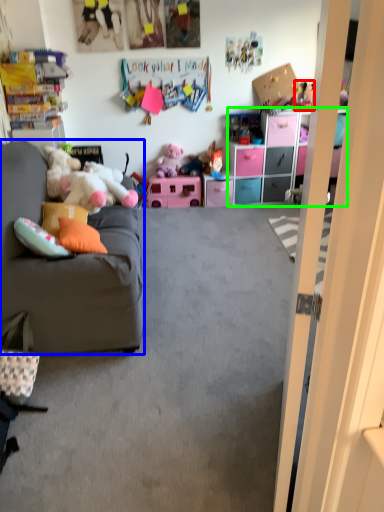
Question: Based on their relative distances, which object is farther from toy (highlighted by a red box)? Choose from studio couch (highlighted by a blue box) and cabinetry (highlighted by a green box).

Choices:
 (A) studio couch
 (B) cabinetry

Answer: (A)